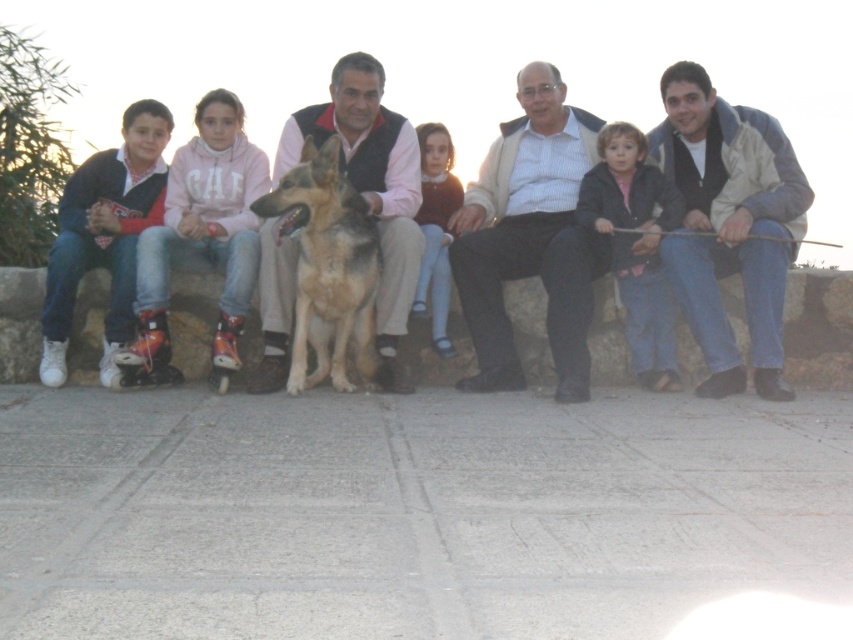
Is brown fur dog at center to the right of white striped shirt at center from the viewer's perspective?

Indeed, brown fur dog at center is positioned on the right side of white striped shirt at center.

Is point (369, 100) behind point (492, 305)?

That is True.

Is point (558, 96) positioned in front of point (512, 260)?

No, it is behind (512, 260).

Locate an element on the screen. Image resolution: width=853 pixels, height=640 pixels. brown fur dog at center is located at coordinates (532, 234).

Between point (508, 196) and point (438, 275), which one is positioned in front?

Point (438, 275) is more forward.

Is white striped shirt at center positioned in front of light brown fabric dress at center?

Yes, it is in front of light brown fabric dress at center.

Is point (589, 288) closer to viewer compared to point (445, 344)?

Yes, point (589, 288) is in front of point (445, 344).

Locate an element on the screen. The width and height of the screenshot is (853, 640). white striped shirt at center is located at coordinates (529, 236).

Is white striped shirt at center taller than golden fur dog at center?

Correct, white striped shirt at center is much taller as golden fur dog at center.

Identify the location of white striped shirt at center. (529, 236).